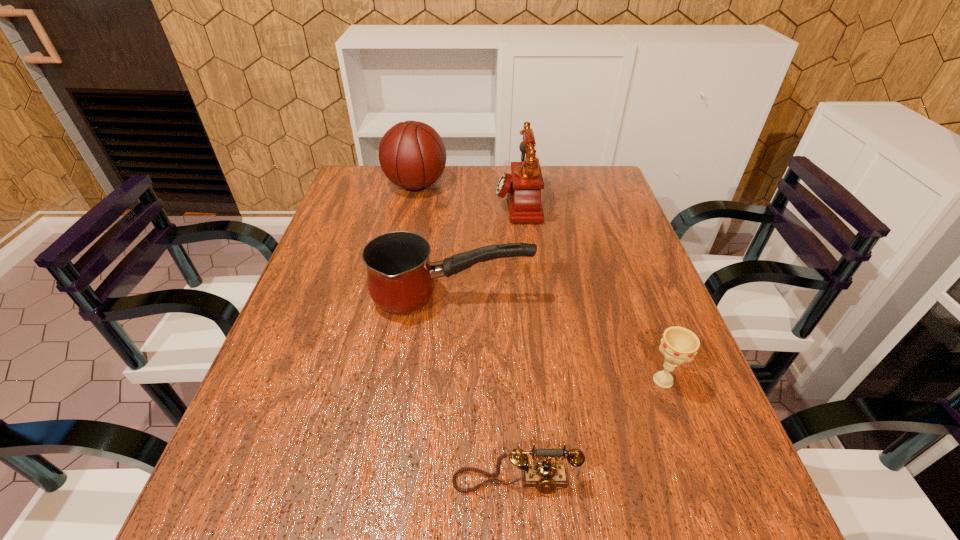
The image size is (960, 540). Find the location of `vacant region at the far edge of the desktop`. vacant region at the far edge of the desktop is located at coordinates (429, 197).

The width and height of the screenshot is (960, 540). I want to click on vacant space at the near edge of the desktop, so click(582, 517).

In the image, there is a desktop. Where is `vacant space at the left edge`? vacant space at the left edge is located at coordinates (233, 448).

Image resolution: width=960 pixels, height=540 pixels. What are the coordinates of `free space at the right edge of the desktop` in the screenshot? It's located at (610, 241).

In the image, there is a desktop. Where is `vacant space at the far left corner`? vacant space at the far left corner is located at coordinates (370, 191).

The image size is (960, 540). I want to click on free space at the far right corner of the desktop, so click(x=570, y=198).

Locate an element on the screen. free space between the farther telephone and the shorter telephone is located at coordinates (516, 342).

At what (x,y) coordinates should I click in order to perform the action: click on unoccupied area between the basketball and the shortest object. Please return your answer as a coordinate pair (x, y). The width and height of the screenshot is (960, 540). Looking at the image, I should click on (466, 334).

Find the location of `vacant point located between the fourth tallest object and the nearer telephone`. vacant point located between the fourth tallest object and the nearer telephone is located at coordinates (589, 431).

The width and height of the screenshot is (960, 540). I want to click on free space between the shorter telephone and the second shortest object, so click(589, 431).